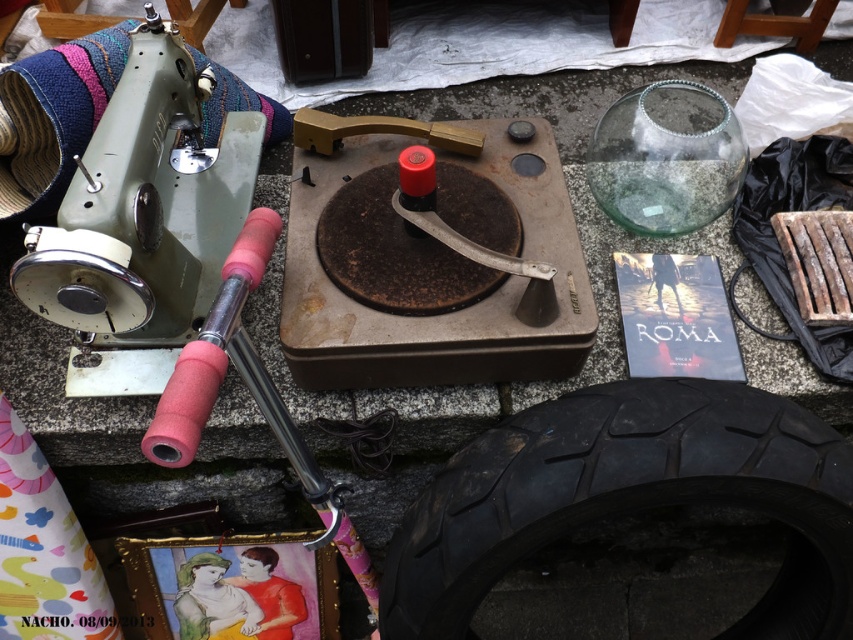
Does black rubber tire at bottom right appear on the right side of matte green sewing machine at left?

Indeed, black rubber tire at bottom right is positioned on the right side of matte green sewing machine at left.

Does black rubber tire at bottom right have a lesser height compared to matte green sewing machine at left?

No.

In order to click on black rubber tire at bottom right in this screenshot , I will do `click(630, 497)`.

Is matte green sewing machine at left shorter than pink foam hammer at upper left?

In fact, matte green sewing machine at left may be taller than pink foam hammer at upper left.

Which is in front, point (151, 276) or point (201, 385)?

Point (201, 385)

In order to click on matte green sewing machine at left in this screenshot , I will do `click(144, 208)`.

Is black rubber tire at bottom right below pink foam hammer at upper left?

Yes.

Which is more to the right, black rubber tire at bottom right or pink foam hammer at upper left?

Positioned to the right is black rubber tire at bottom right.

Which is in front, point (838, 630) or point (231, 308)?

Point (231, 308) is more forward.

Identify the location of black rubber tire at bottom right. The image size is (853, 640). (630, 497).